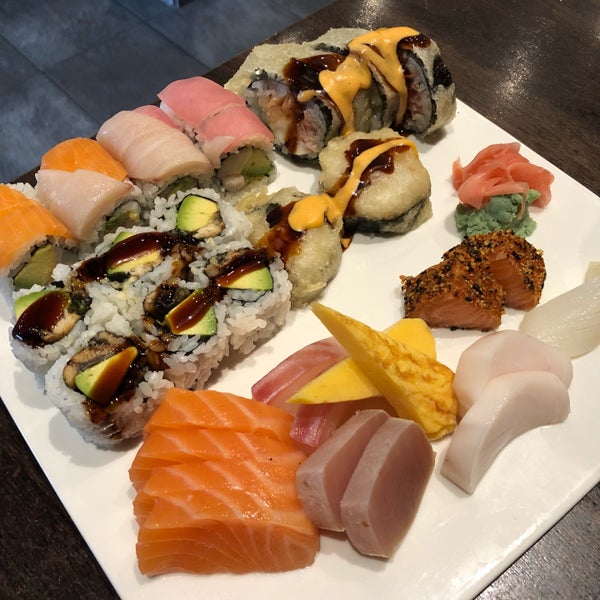
The image size is (600, 600). In order to click on empty space in front of platter on table in this screenshot , I will do `click(561, 567)`.